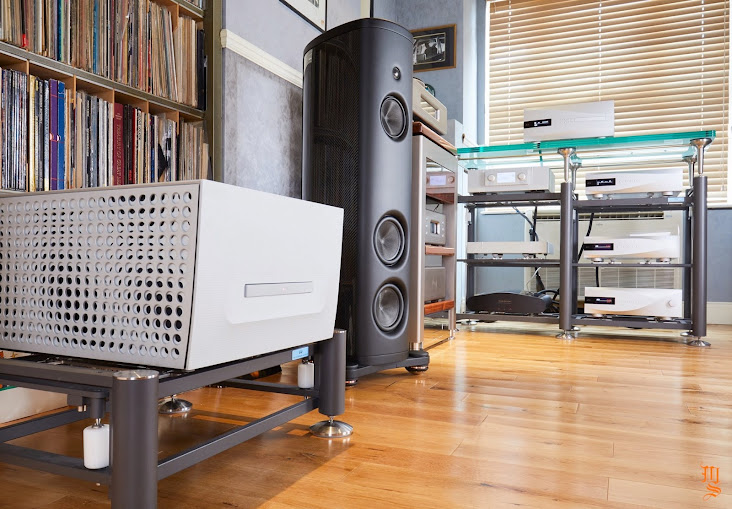
Image resolution: width=732 pixels, height=509 pixels. In order to click on speaker in this screenshot , I will do `click(378, 154)`.